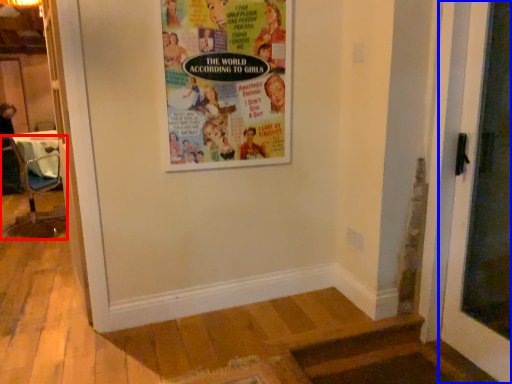
Question: Which of the following is the closest to the observer, chair (highlighted by a red box) or door (highlighted by a blue box)?

Choices:
 (A) chair
 (B) door

Answer: (B)